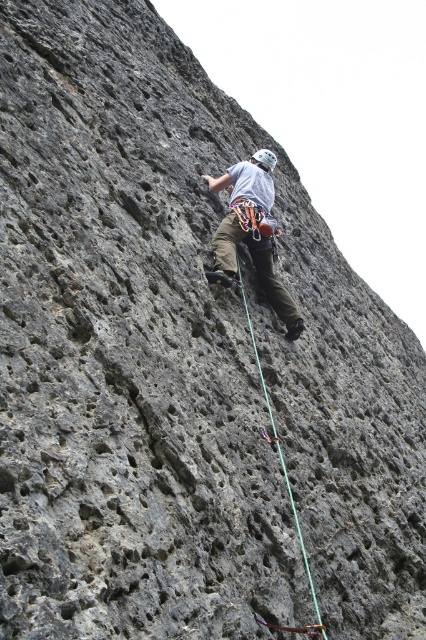
Question: Among these objects, which one is nearest to the camera?

Choices:
 (A) green nylon rope at center
 (B) matte gray climbing harness at center

Answer: (A)

Question: Which object appears farthest from the camera in this image?

Choices:
 (A) green nylon rope at center
 (B) matte gray climbing harness at center

Answer: (B)

Question: Is matte gray climbing harness at center behind green nylon rope at center?

Choices:
 (A) yes
 (B) no

Answer: (A)

Question: Is matte gray climbing harness at center positioned before green nylon rope at center?

Choices:
 (A) no
 (B) yes

Answer: (A)

Question: Which point is farther from the camera taking this photo?

Choices:
 (A) (241, 200)
 (B) (299, 524)

Answer: (A)

Question: Is matte gray climbing harness at center smaller than green nylon rope at center?

Choices:
 (A) no
 (B) yes

Answer: (A)